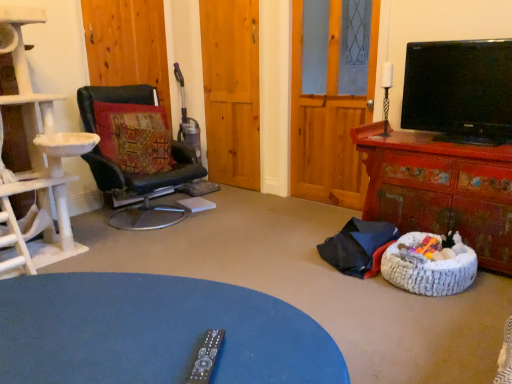
You are a GUI agent. You are given a task and a screenshot of the screen. Output one action in this format:
    pyautogui.click(x=<x>, y=<y>)
    Task: Click on the black glossy tv at upper right
    This screenshot has width=512, height=384.
    Given the screenshot: What is the action you would take?
    pyautogui.click(x=459, y=90)

At what (x,y) coordinates should I click in order to perform the action: click on wooden door at center, the 2th door when ordered from left to right. Please return your answer as a coordinate pair (x, y). This screenshot has height=384, width=512. Looking at the image, I should click on (231, 90).

Describe the element at coordinates (231, 90) in the screenshot. I see `wooden door at center, the first door positioned from the right` at that location.

The width and height of the screenshot is (512, 384). What do you see at coordinates (135, 154) in the screenshot?
I see `black leather chair at left` at bounding box center [135, 154].

Describe the element at coordinates (134, 136) in the screenshot. This screenshot has height=384, width=512. I see `textured fabric pillow at left` at that location.

This screenshot has width=512, height=384. I want to click on black plastic remote at center, so click(x=206, y=357).

From the image's perspective, relative to white woven dog bed at lower right, is wooden door at center, the 2th door when ordered from left to right, above or below?

From the image's perspective, wooden door at center, the 2th door when ordered from left to right, appears above white woven dog bed at lower right.

In the image, is wooden door at center, the first door positioned from the right, on the left side or the right side of white woven dog bed at lower right?

wooden door at center, the first door positioned from the right, is to the left of white woven dog bed at lower right.

Would you say wooden door at center, the 2th door when ordered from left to right, contains white woven dog bed at lower right?

That's incorrect, white woven dog bed at lower right is not inside wooden door at center, the 2th door when ordered from left to right.

Considering the sizes of wooden door at center, the 2th door when ordered from left to right, and white woven dog bed at lower right in the image, is wooden door at center, the 2th door when ordered from left to right, bigger or smaller than white woven dog bed at lower right?

In the image, wooden door at center, the 2th door when ordered from left to right, appears to be larger than white woven dog bed at lower right.

Is black fabric remote control at center turned away from black plastic remote at center?

No, black fabric remote control at center is not facing away from black plastic remote at center.

Is black fabric remote control at center next to black plastic remote at center and touching it?

No, black fabric remote control at center is not with black plastic remote at center.

Locate an element on the screen. The width and height of the screenshot is (512, 384). remote above the black fabric remote control at center (from the image's perspective) is located at coordinates [x=206, y=357].

Does point (11, 344) appear closer or farther from the camera than point (200, 356)?

Point (11, 344) appears to be farther away from the viewer than point (200, 356).

Considering the positions of points (463, 171) and (159, 96), is point (463, 171) farther from camera compared to point (159, 96)?

No, (463, 171) is in front of (159, 96).

How many degrees apart are the facing directions of distressed red wooden cabinet at right and wooden door at center, the first door viewed from the left?

distressed red wooden cabinet at right and wooden door at center, the first door viewed from the left, are facing 91.8 degrees away from each other.

Which object is closer to the camera, distressed red wooden cabinet at right or wooden door at center, the first door viewed from the left?

distressed red wooden cabinet at right is in front.

Between white woven dog bed at lower right and wooden door at center, marked as the 2th door in a right-to-left arrangement, which one has larger width?

With larger width is white woven dog bed at lower right.

From the white woven dog bed at lower right, count the 2nd door to the left and point to it. Please provide its 2D coordinates.

[(127, 44)]

From the image's perspective, is white woven dog bed at lower right under wooden door at center, the first door viewed from the left?

Yes, from the image's perspective, white woven dog bed at lower right is beneath wooden door at center, the first door viewed from the left.

How distant is white woven dog bed at lower right from wooden door at center, marked as the 2th door in a right-to-left arrangement?

white woven dog bed at lower right and wooden door at center, marked as the 2th door in a right-to-left arrangement, are 2.59 meters apart from each other.

From the image's perspective, would you say black plastic remote at center is positioned over wooden glass door at center?

No, from the image's perspective, black plastic remote at center is not over wooden glass door at center.

In the scene shown: Is black plastic remote at center aimed at wooden glass door at center?

Yes, black plastic remote at center is oriented towards wooden glass door at center.

Consider the image. Does black plastic remote at center touch wooden glass door at center?

black plastic remote at center and wooden glass door at center are not in contact.

Is the depth of black plastic remote at center greater than that of wooden glass door at center?

No, black plastic remote at center is closer to the viewer.

Is black fabric remote control at center surrounding wooden door at center, the 2th door when ordered from left to right?

Definitely not — wooden door at center, the 2th door when ordered from left to right, is not inside black fabric remote control at center.

From a real-world perspective, which is physically above, black fabric remote control at center or wooden door at center, the first door positioned from the right?

wooden door at center, the first door positioned from the right.

From the image's perspective, who appears lower, black fabric remote control at center or wooden door at center, the first door positioned from the right?

From the image's view, black fabric remote control at center is below.

Does point (131, 274) come behind point (205, 56)?

No.

Who is shorter, textured fabric pillow at left or black leather chair at left?

textured fabric pillow at left.

From a real-world perspective, which object stands above the other?

textured fabric pillow at left, from a real-world perspective.

Consider the image. Is textured fabric pillow at left oriented away from black leather chair at left?

Absolutely, textured fabric pillow at left is directed away from black leather chair at left.

Which door is the 2nd one when counting from the back of the white woven dog bed at lower right? Please provide its 2D coordinates.

[(231, 90)]

You are a GUI agent. You are given a task and a screenshot of the screen. Output one action in this format:
    pyautogui.click(x=<x>, y=<y>)
    Task: Click on the desk in front of the black plastic remote at center
    The image size is (512, 384).
    Given the screenshot: What is the action you would take?
    coord(155,332)

Based on their spatial positions, is black glossy tv at upper right or black fabric remote control at center closer to wooden glass door at center?

Among the two, black glossy tv at upper right is located nearer to wooden glass door at center.

When comparing their distances from wooden door at center, the 2th door when ordered from left to right, does black glossy tv at upper right or white woven dog bed at lower right seem further?

white woven dog bed at lower right lies further to wooden door at center, the 2th door when ordered from left to right, than the other object.

Based on their spatial positions, is wooden glass door at center or black glossy tv at upper right further from textured fabric pillow at left?

The object further to textured fabric pillow at left is black glossy tv at upper right.

Based on their spatial positions, is black glossy tv at upper right or textured fabric pillow at left closer to black fabric remote control at center?

textured fabric pillow at left lies closer to black fabric remote control at center than the other object.

Looking at the image, which one is located further to textured fabric pillow at left, distressed red wooden cabinet at right or black fabric remote control at center?

black fabric remote control at center lies further to textured fabric pillow at left than the other object.

From the picture: When comparing their distances from wooden glass door at center, does distressed red wooden cabinet at right or white woven dog bed at lower right seem closer?

distressed red wooden cabinet at right is closer to wooden glass door at center.

Estimate the real-world distances between objects in this image. Which object is closer to wooden door at center, the 2th door when ordered from left to right, wooden door at center, the first door viewed from the left, or wooden glass door at center?

The object closer to wooden door at center, the 2th door when ordered from left to right, is wooden door at center, the first door viewed from the left.

In the scene shown: When comparing their distances from black plastic remote at center, does textured fabric pillow at left or distressed red wooden cabinet at right seem further?

textured fabric pillow at left.

Where is `pillow between black plastic remote at center and wooden door at center, the first door viewed from the left, in the front-back direction`? Image resolution: width=512 pixels, height=384 pixels. pillow between black plastic remote at center and wooden door at center, the first door viewed from the left, in the front-back direction is located at coordinates (134, 136).

Identify the location of desk between wooden door at center, marked as the 2th door in a right-to-left arrangement, and black glossy tv at upper right from left to right. (155, 332).

The width and height of the screenshot is (512, 384). Identify the location of pillow between wooden door at center, the first door viewed from the left, and white woven dog bed at lower right, in the horizontal direction. (134, 136).

Identify the location of door between wooden door at center, the first door viewed from the left, and white woven dog bed at lower right from left to right. (231, 90).